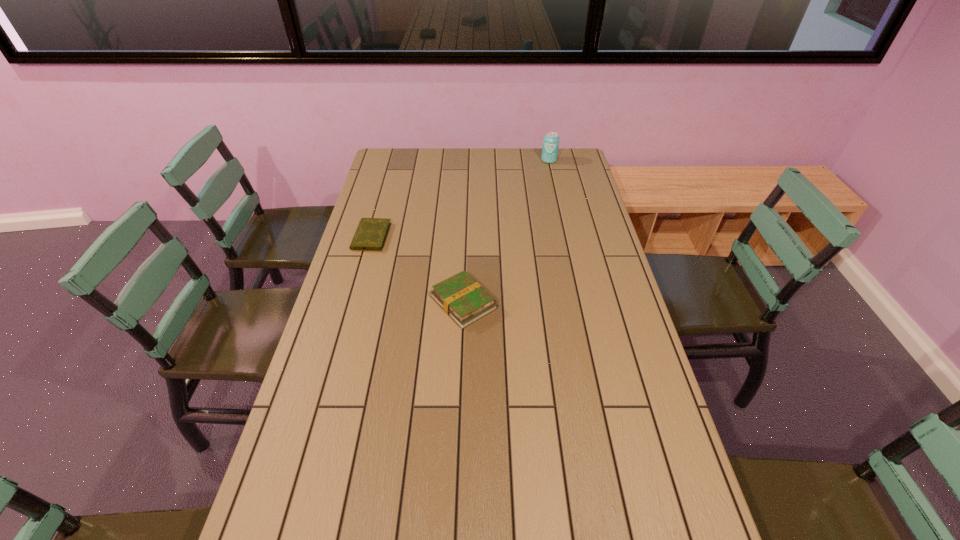
Where is `object located at the left edge`? The height and width of the screenshot is (540, 960). object located at the left edge is located at coordinates (371, 233).

Identify the location of object that is at the right edge. (x=550, y=147).

Where is `object located at the far right corner`? object located at the far right corner is located at coordinates (550, 147).

The width and height of the screenshot is (960, 540). I want to click on free space at the far edge of the desktop, so click(434, 174).

Where is `blank space at the left edge of the desktop`? This screenshot has width=960, height=540. blank space at the left edge of the desktop is located at coordinates (360, 305).

In the image, there is a desktop. In order to click on blank space at the right edge in this screenshot , I will do `click(566, 177)`.

Where is `free spot between the second tallest object and the rightmost object`? free spot between the second tallest object and the rightmost object is located at coordinates (506, 232).

In order to click on vacant area between the beer can and the second object from right to left in this screenshot , I will do `click(506, 232)`.

Locate an element on the screen. Image resolution: width=960 pixels, height=540 pixels. free space between the rightmost object and the second nearest object is located at coordinates (460, 198).

You are a GUI agent. You are given a task and a screenshot of the screen. Output one action in this format:
    pyautogui.click(x=<x>, y=<y>)
    Task: Click on the vacant space that's between the diary and the second object from left to right
    
    Given the screenshot: What is the action you would take?
    pyautogui.click(x=418, y=269)